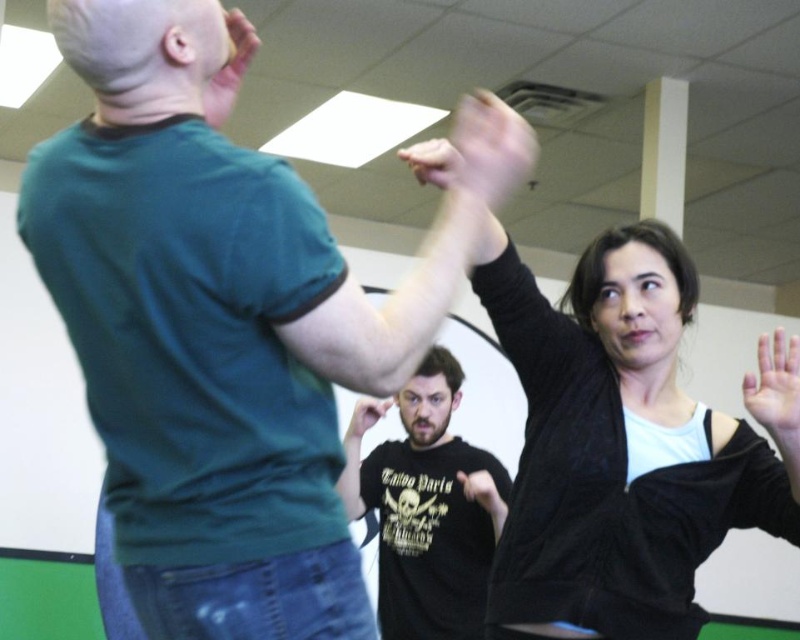
Can you confirm if black matte jacket at upper right is bigger than matte black t-shirt at center?

Yes, black matte jacket at upper right is bigger than matte black t-shirt at center.

Who is lower down, black matte jacket at upper right or matte black t-shirt at center?

matte black t-shirt at center

Find the location of `black matte jacket at upper right`. black matte jacket at upper right is located at coordinates (614, 448).

Between black matte t-shirt at center and black matte hand at upper right, which one has less height?

black matte hand at upper right

Is black matte t-shirt at center taller than black matte hand at upper right?

Yes.

Locate an element on the screen. black matte t-shirt at center is located at coordinates (426, 513).

Who is positioned more to the left, black matte arm at upper center or matte green shirt at upper left?

matte green shirt at upper left

The width and height of the screenshot is (800, 640). Identify the location of black matte arm at upper center. (474, 144).